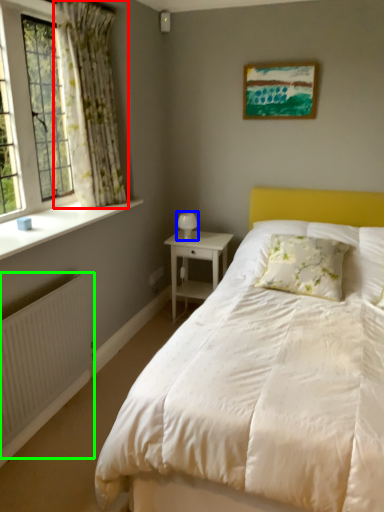
Question: Which object is the farthest from curtain (highlighted by a red box)? Choose among these: table lamp (highlighted by a blue box) or radiator (highlighted by a green box).

Choices:
 (A) table lamp
 (B) radiator

Answer: (B)